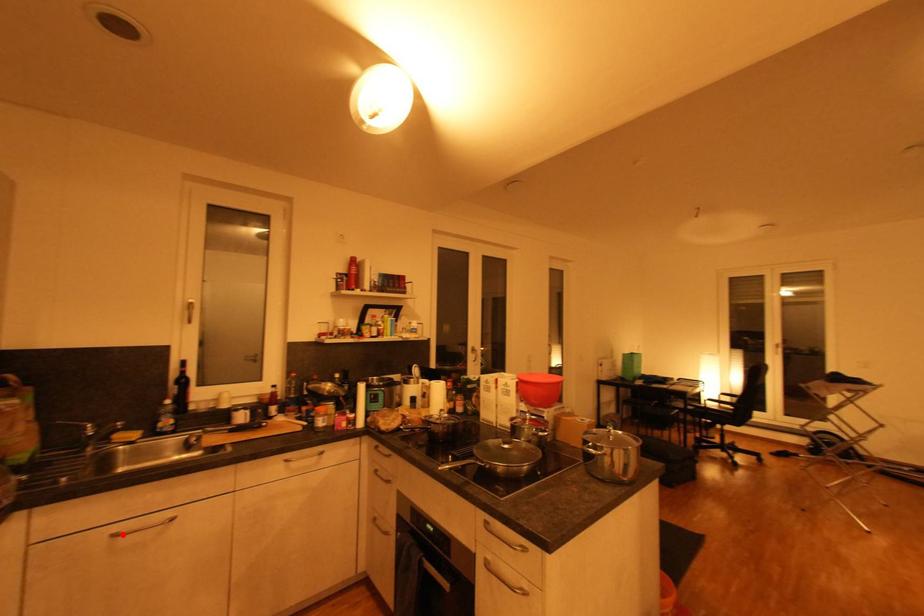
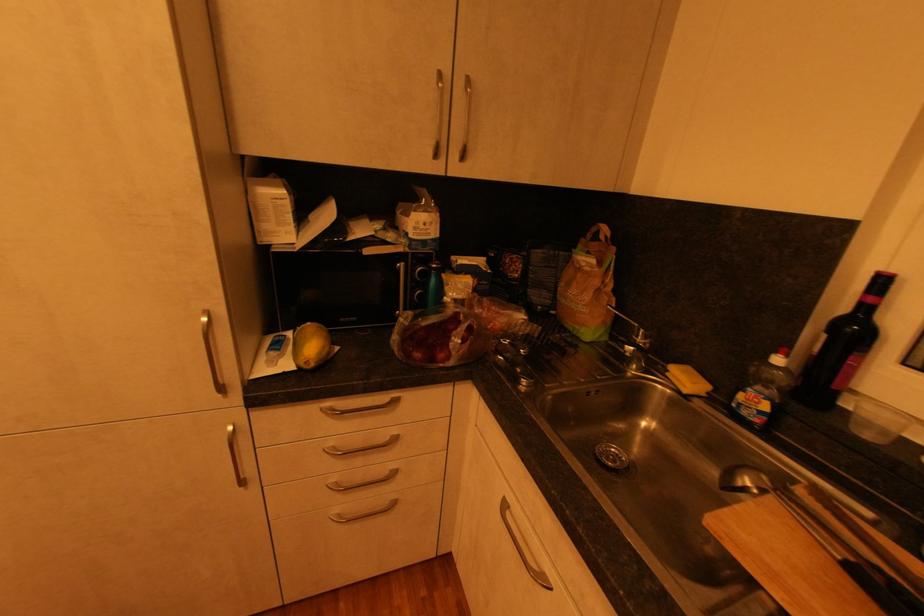
In the second image, find the point that corresponds to the highlighted location in the first image.

(508, 507)